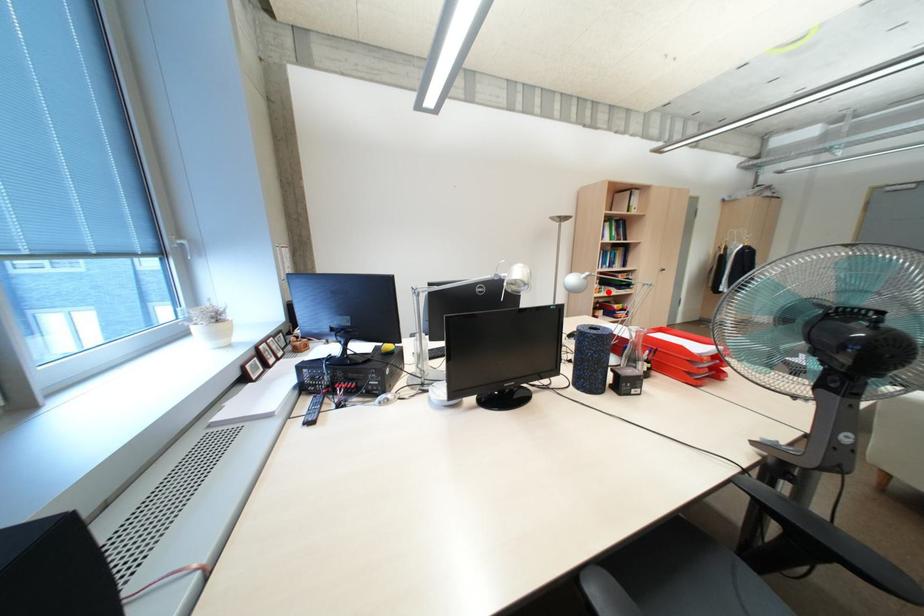
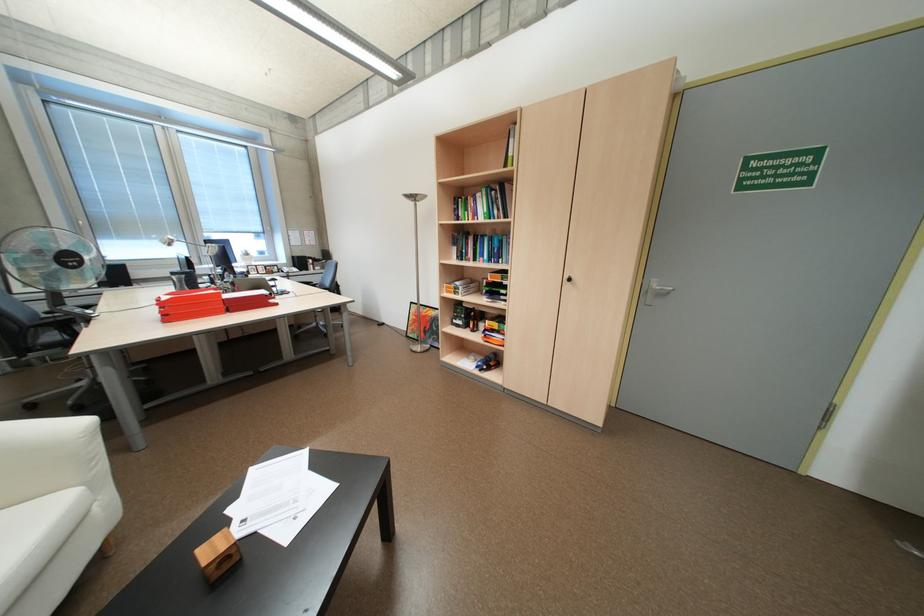
Question: A red point is marked in image1. In image2, is the corresponding 3D point closer to the camera or farther? Reply with the corresponding letter.

Choices:
 (A) The corresponding 3D point is closer.
 (B) The corresponding 3D point is farther.

Answer: (A)